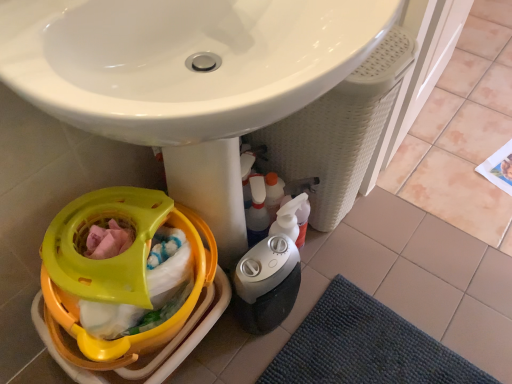
Identify the location of free spot above dark blue textured bath mat at lower right (from a real-world perspective). This screenshot has height=384, width=512. (366, 352).